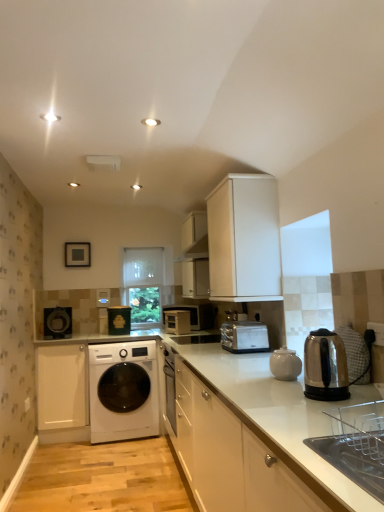
Question: Is satin silver toaster at center, which appears as the first home appliance when viewed from the back, closer to the viewer compared to transparent plastic window screen at center, the 2th window screen in the bottom-to-top sequence?

Choices:
 (A) yes
 (B) no

Answer: (A)

Question: From the image's perspective, does satin silver toaster at center, which appears as the first home appliance when viewed from the back, appear higher than transparent plastic window screen at center, the 2th window screen in the bottom-to-top sequence?

Choices:
 (A) yes
 (B) no

Answer: (B)

Question: Is satin silver toaster at center, which appears as the first home appliance when viewed from the back, bigger than transparent plastic window screen at center, placed as the first window screen when sorted from top to bottom?

Choices:
 (A) yes
 (B) no

Answer: (B)

Question: Is satin silver toaster at center, which appears as the first home appliance when viewed from the back, positioned far away from transparent plastic window screen at center, placed as the first window screen when sorted from top to bottom?

Choices:
 (A) no
 (B) yes

Answer: (B)

Question: Is satin silver toaster at center, the 2th home appliance when ordered from front to back, shorter than transparent plastic window screen at center, the 2th window screen in the bottom-to-top sequence?

Choices:
 (A) yes
 (B) no

Answer: (A)

Question: Is satin silver toaster at center, which appears as the first home appliance when viewed from the back, next to transparent plastic window screen at center, placed as the first window screen when sorted from top to bottom, and touching it?

Choices:
 (A) no
 (B) yes

Answer: (A)

Question: Is the surface of metallic silver toaster at center, which is counted as the 3th appliance, starting from the left, in direct contact with white glossy cabinet at center, which is the third cabinetry in right-to-left order?

Choices:
 (A) yes
 (B) no

Answer: (B)

Question: Is metallic silver toaster at center, which is counted as the 3th appliance, starting from the left, smaller than white glossy cabinet at center, which is the third cabinetry in right-to-left order?

Choices:
 (A) no
 (B) yes

Answer: (B)

Question: Is metallic silver toaster at center, which is counted as the 3th appliance, starting from the left, surrounding white glossy cabinet at center, which is the third cabinetry in right-to-left order?

Choices:
 (A) no
 (B) yes

Answer: (A)

Question: Can you confirm if metallic silver toaster at center, the 1th appliance viewed from the right, is thinner than white glossy cabinet at center, placed as the 2th cabinetry when sorted from left to right?

Choices:
 (A) no
 (B) yes

Answer: (B)

Question: Are metallic silver toaster at center, which is counted as the 3th appliance, starting from the left, and white glossy cabinet at center, placed as the 2th cabinetry when sorted from left to right, located far from each other?

Choices:
 (A) no
 (B) yes

Answer: (B)

Question: Can you confirm if metallic silver toaster at center, the 1th appliance viewed from the right, is positioned to the right of white glossy cabinet at center, which is the third cabinetry in right-to-left order?

Choices:
 (A) yes
 (B) no

Answer: (B)

Question: Can you confirm if white matte cabinet at upper center, the 2th cabinetry from the right, is positioned to the left of transparent plastic window screen at center, placed as the first window screen when sorted from top to bottom?

Choices:
 (A) no
 (B) yes

Answer: (A)